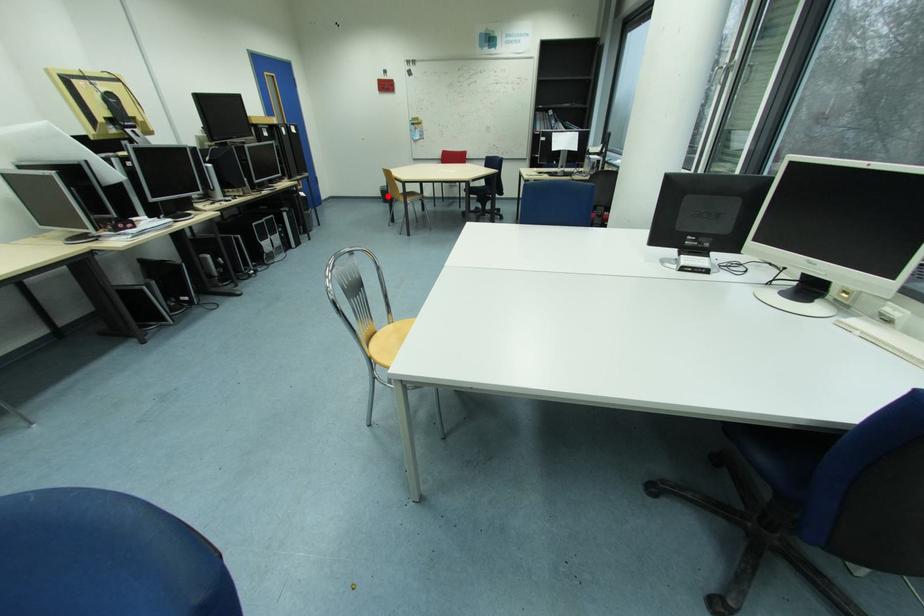
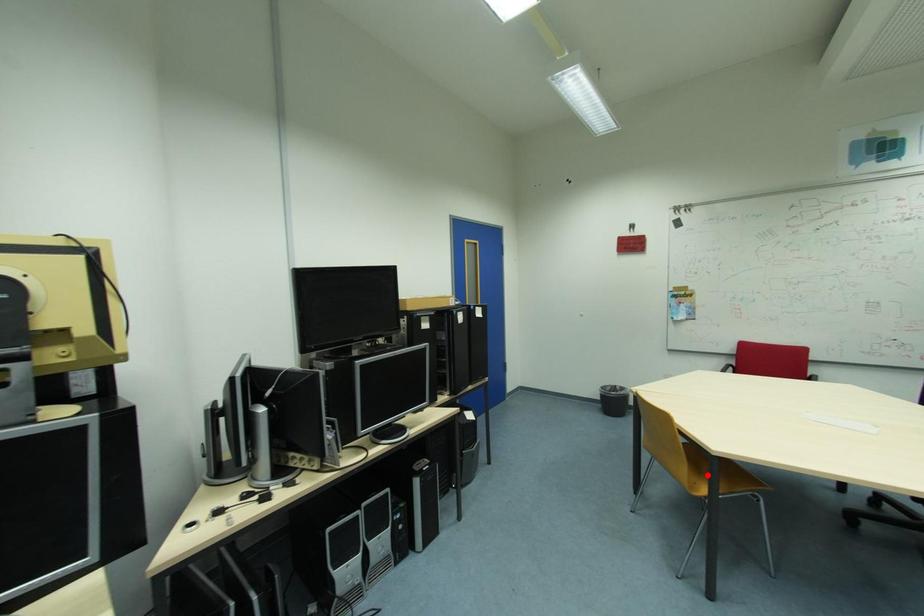
I am providing you with two images of the same scene from different viewpoints. A red point is marked on the first image and another point is marked on the second image. Are the points marked in image1 and image2 representing the same 3D position?

No